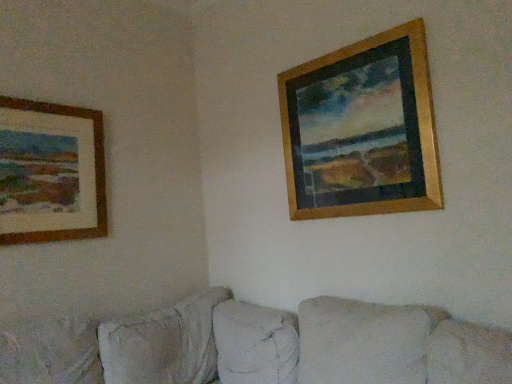
Question: Is beige fabric couch at lower center aimed at wooden frame at left, which ranks as the second picture frame in right-to-left order?

Choices:
 (A) no
 (B) yes

Answer: (A)

Question: Does beige fabric couch at lower center touch wooden frame at left, positioned as the 1th picture frame in left-to-right order?

Choices:
 (A) yes
 (B) no

Answer: (B)

Question: From the image's perspective, does beige fabric couch at lower center appear higher than wooden frame at left, which ranks as the second picture frame in right-to-left order?

Choices:
 (A) yes
 (B) no

Answer: (B)

Question: Considering the relative sizes of beige fabric couch at lower center and wooden frame at left, which ranks as the second picture frame in right-to-left order, in the image provided, is beige fabric couch at lower center wider than wooden frame at left, which ranks as the second picture frame in right-to-left order,?

Choices:
 (A) no
 (B) yes

Answer: (B)

Question: Does beige fabric couch at lower center appear on the right side of wooden frame at left, which ranks as the second picture frame in right-to-left order?

Choices:
 (A) yes
 (B) no

Answer: (A)

Question: Considering the positions of wooden frame at left, which ranks as the second picture frame in right-to-left order, and wooden frame at upper right, which appears as the first picture frame when viewed from the right, in the image, is wooden frame at left, which ranks as the second picture frame in right-to-left order, wider or thinner than wooden frame at upper right, which appears as the first picture frame when viewed from the right,?

Choices:
 (A) wide
 (B) thin

Answer: (B)

Question: From a real-world perspective, relative to wooden frame at upper right, which appears as the first picture frame when viewed from the right, is wooden frame at left, which ranks as the second picture frame in right-to-left order, vertically above or below?

Choices:
 (A) above
 (B) below

Answer: (B)

Question: Is wooden frame at left, positioned as the 1th picture frame in left-to-right order, in front of or behind wooden frame at upper right, the 2th picture frame from the left, in the image?

Choices:
 (A) front
 (B) behind

Answer: (B)

Question: Is wooden frame at left, positioned as the 1th picture frame in left-to-right order, spatially inside wooden frame at upper right, which appears as the first picture frame when viewed from the right, or outside of it?

Choices:
 (A) inside
 (B) outside

Answer: (B)

Question: Is wooden frame at upper right, the 2th picture frame from the left, spatially inside beige fabric couch at lower center, or outside of it?

Choices:
 (A) outside
 (B) inside

Answer: (A)

Question: Considering the positions of wooden frame at upper right, the 2th picture frame from the left, and beige fabric couch at lower center in the image, is wooden frame at upper right, the 2th picture frame from the left, taller or shorter than beige fabric couch at lower center?

Choices:
 (A) tall
 (B) short

Answer: (A)

Question: Is wooden frame at upper right, the 2th picture frame from the left, bigger or smaller than beige fabric couch at lower center?

Choices:
 (A) small
 (B) big

Answer: (A)

Question: Is wooden frame at upper right, the 2th picture frame from the left, wider or thinner than beige fabric couch at lower center?

Choices:
 (A) thin
 (B) wide

Answer: (A)

Question: Relative to beige fabric couch at lower center, is wooden frame at left, positioned as the 1th picture frame in left-to-right order, in front or behind?

Choices:
 (A) front
 (B) behind

Answer: (B)

Question: In terms of size, does wooden frame at left, positioned as the 1th picture frame in left-to-right order, appear bigger or smaller than beige fabric couch at lower center?

Choices:
 (A) big
 (B) small

Answer: (B)